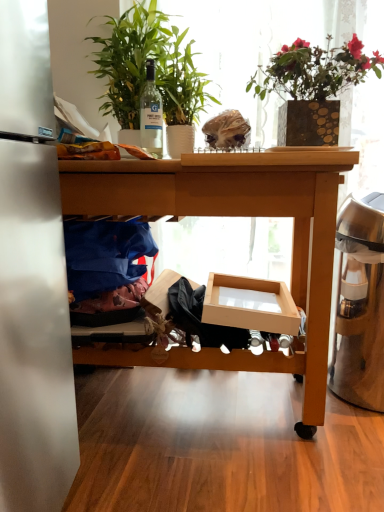
Question: Considering the relative sizes of wooden desk at center and cardboard box at center in the image provided, is wooden desk at center smaller than cardboard box at center?

Choices:
 (A) yes
 (B) no

Answer: (B)

Question: Is wooden desk at center to the left of cardboard box at center from the viewer's perspective?

Choices:
 (A) yes
 (B) no

Answer: (A)

Question: Is wooden desk at center oriented away from cardboard box at center?

Choices:
 (A) yes
 (B) no

Answer: (A)

Question: Is wooden desk at center located outside cardboard box at center?

Choices:
 (A) yes
 (B) no

Answer: (A)

Question: From the image's perspective, is wooden desk at center above cardboard box at center?

Choices:
 (A) yes
 (B) no

Answer: (A)

Question: Is cardboard box at center completely or partially inside wooden desk at center?

Choices:
 (A) yes
 (B) no

Answer: (A)

Question: From a real-world perspective, is satin silver trash can at right positioned under gold textured vase at upper right, marked as the second houseplant in a left-to-right arrangement, based on gravity?

Choices:
 (A) yes
 (B) no

Answer: (A)

Question: Is satin silver trash can at right shorter than gold textured vase at upper right, marked as the second houseplant in a left-to-right arrangement?

Choices:
 (A) no
 (B) yes

Answer: (A)

Question: Does satin silver trash can at right appear on the left side of gold textured vase at upper right, placed as the first houseplant when sorted from right to left?

Choices:
 (A) yes
 (B) no

Answer: (B)

Question: Is satin silver trash can at right not close to gold textured vase at upper right, marked as the second houseplant in a left-to-right arrangement?

Choices:
 (A) no
 (B) yes

Answer: (A)

Question: From a real-world perspective, is satin silver trash can at right on gold textured vase at upper right, placed as the first houseplant when sorted from right to left?

Choices:
 (A) yes
 (B) no

Answer: (B)

Question: Is satin silver trash can at right surrounding gold textured vase at upper right, marked as the second houseplant in a left-to-right arrangement?

Choices:
 (A) yes
 (B) no

Answer: (B)

Question: Is clear glass bottle at center a part of green leafy plant at upper left, which is counted as the 2th houseplant, starting from the right?

Choices:
 (A) no
 (B) yes

Answer: (B)